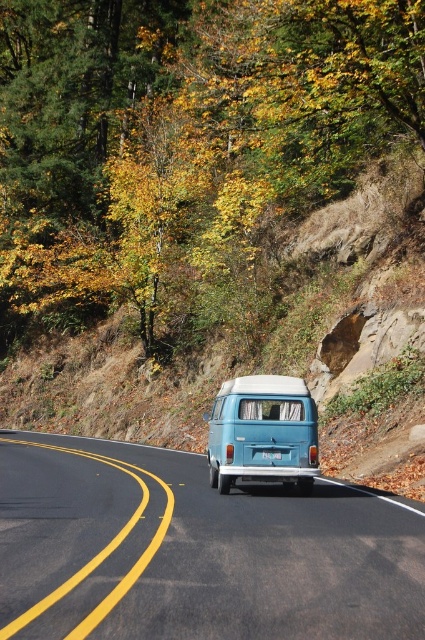
Between yellow-green leaves at upper center and teal matte van at center, which one has more height?

yellow-green leaves at upper center

Who is more forward, [96,13] or [280,477]?

Positioned in front is point [280,477].

This screenshot has width=425, height=640. I want to click on yellow-green leaves at upper center, so click(x=181, y=141).

Describe the element at coordinates (193, 552) in the screenshot. The image size is (425, 640). I see `blue matte van at center` at that location.

Where is `blue matte van at center`? This screenshot has width=425, height=640. blue matte van at center is located at coordinates (193, 552).

Who is positioned more to the left, yellow-green leaves at upper center or blue matte van at center?

From the viewer's perspective, yellow-green leaves at upper center appears more on the left side.

The height and width of the screenshot is (640, 425). Find the location of `yellow-green leaves at upper center`. yellow-green leaves at upper center is located at coordinates (181, 141).

You are a GUI agent. You are given a task and a screenshot of the screen. Output one action in this format:
    pyautogui.click(x=<x>, y=<y>)
    Task: Click on the yellow-green leaves at upper center
    The width and height of the screenshot is (425, 640).
    Given the screenshot: What is the action you would take?
    pyautogui.click(x=181, y=141)